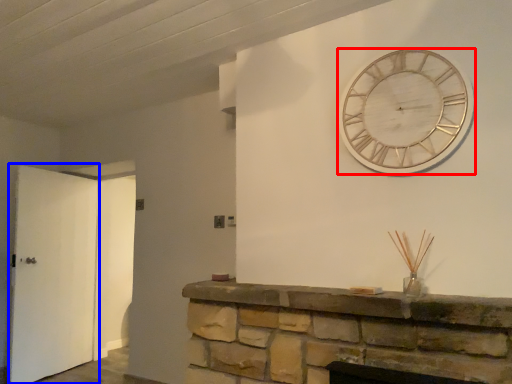
Question: Which object is further to the camera taking this photo, wall clock (highlighted by a red box) or door (highlighted by a blue box)?

Choices:
 (A) wall clock
 (B) door

Answer: (B)